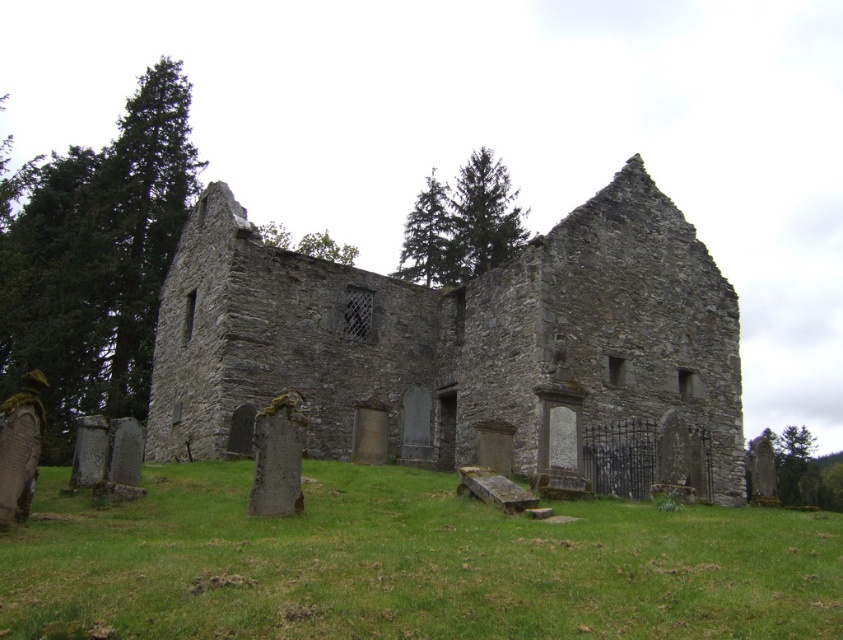
Between point (521, 554) and point (513, 452), which one is positioned in front?

Point (521, 554) is in front.

Can you confirm if green grass at center is positioned to the left of gray stone castle at center?

Correct, you'll find green grass at center to the left of gray stone castle at center.

In order to click on green grass at center in this screenshot , I will do `click(407, 563)`.